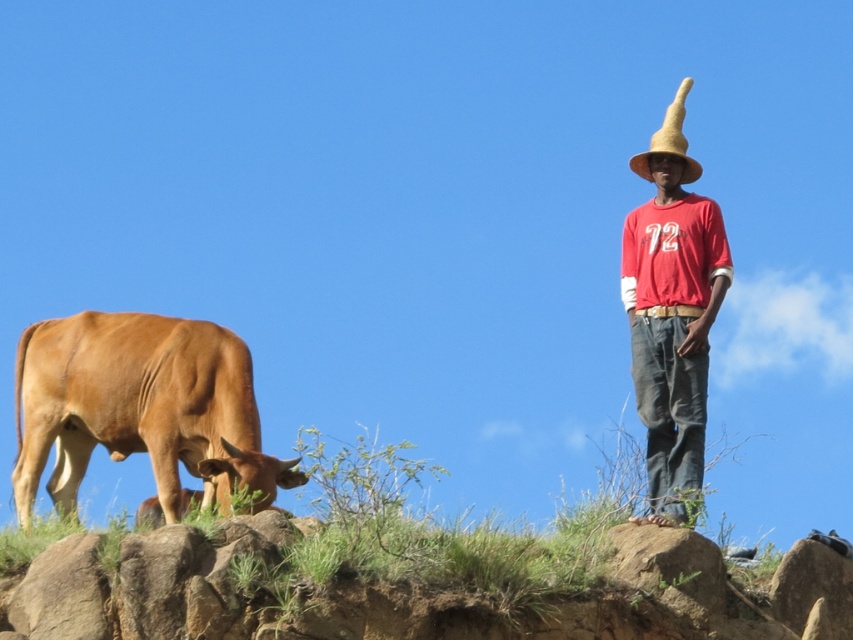
Question: Can you confirm if brown smooth bull at left is wider than straw at right?

Choices:
 (A) yes
 (B) no

Answer: (A)

Question: From the image, what is the correct spatial relationship of brown smooth bull at left in relation to straw at right?

Choices:
 (A) left
 (B) right

Answer: (A)

Question: Is red cotton shirt at right wider than straw at right?

Choices:
 (A) yes
 (B) no

Answer: (B)

Question: Among these objects, which one is farthest from the camera?

Choices:
 (A) red cotton shirt at right
 (B) straw at right
 (C) brown smooth bull at left

Answer: (B)

Question: Which of the following is the closest to the observer?

Choices:
 (A) (204, 508)
 (B) (699, 336)

Answer: (A)

Question: Among these objects, which one is nearest to the camera?

Choices:
 (A) red cotton shirt at right
 (B) straw at right
 (C) brown smooth bull at left

Answer: (C)